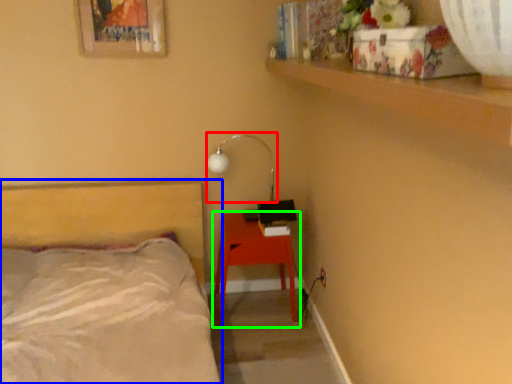
Question: Considering the real-world distances, which object is farthest from lamp (highlighted by a red box)? bed (highlighted by a blue box) or nightstand (highlighted by a green box)?

Choices:
 (A) bed
 (B) nightstand

Answer: (A)